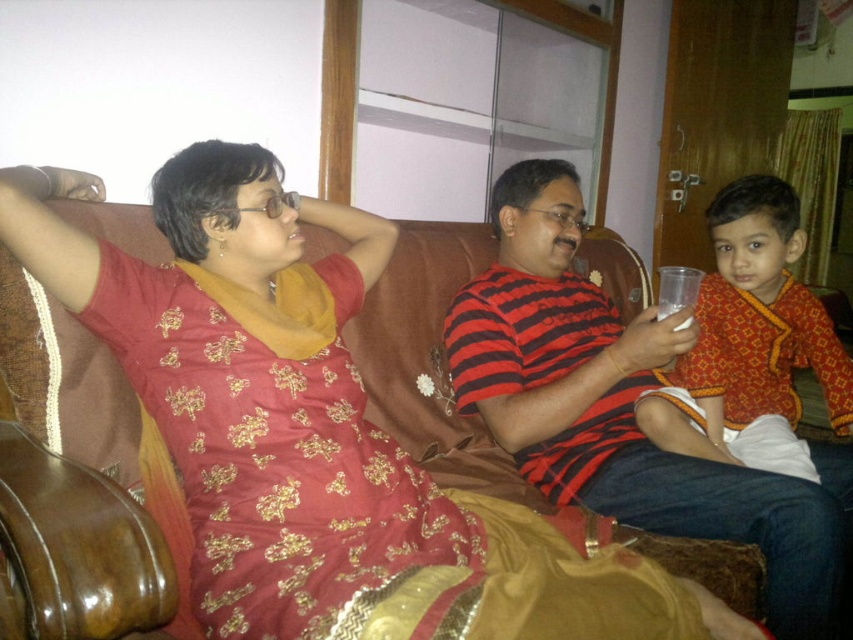
Is brown leather couch at center thinner than striped cotton shirt at center?

No, brown leather couch at center is not thinner than striped cotton shirt at center.

Does point (33, 268) come closer to viewer compared to point (573, 237)?

Yes, it is.

You are a GUI agent. You are given a task and a screenshot of the screen. Output one action in this format:
    pyautogui.click(x=<x>, y=<y>)
    Task: Click on the brown leather couch at center
    The width and height of the screenshot is (853, 640).
    Given the screenshot: What is the action you would take?
    point(321,445)

Measure the distance from matte orange shirt at right to clear plastic cup at center.

matte orange shirt at right is 36.83 centimeters from clear plastic cup at center.

Is point (759, 352) positioned after point (663, 300)?

Yes, point (759, 352) is behind point (663, 300).

Identify the location of matte orange shirt at right. This screenshot has height=640, width=853. (751, 342).

Which is below, brown leather couch at center or matte orange shirt at right?

brown leather couch at center

The image size is (853, 640). Describe the element at coordinates (321, 445) in the screenshot. I see `brown leather couch at center` at that location.

Identify the location of brown leather couch at center. (321, 445).